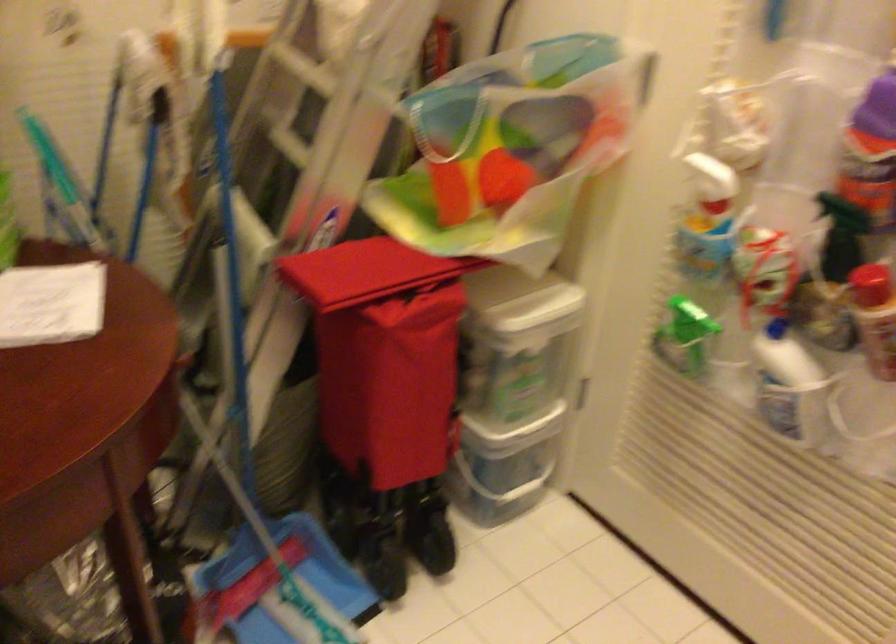
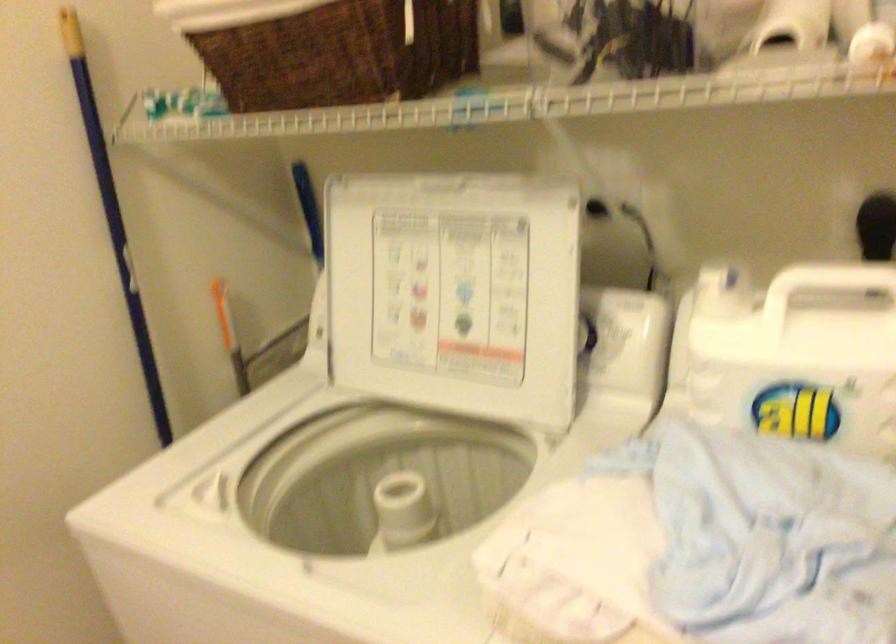
How did the camera likely rotate?

The rotation direction of the camera is right-down.